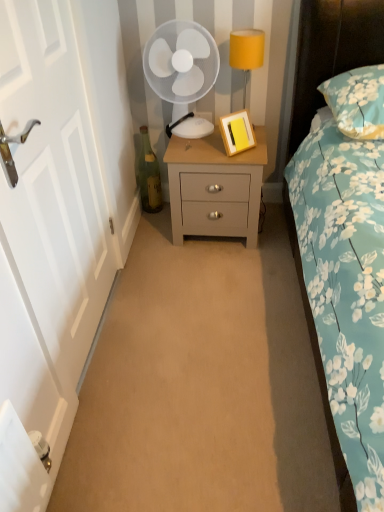
Locate an element on the screen. This screenshot has height=512, width=384. vacant area on the back side of white painted wood door at left is located at coordinates (148, 260).